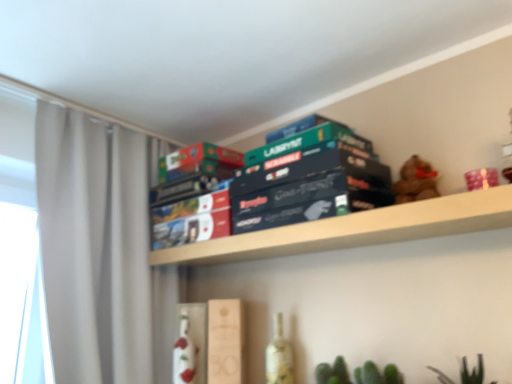
Question: Does dark blue cardboard game box at center have a greater width compared to green matte board game at center, marked as the 3th paperback book in a top-to-bottom arrangement?

Choices:
 (A) yes
 (B) no

Answer: (A)

Question: Does dark blue cardboard game box at center appear on the left side of green matte board game at center, positioned as the 2th paperback book in bottom-to-top order?

Choices:
 (A) no
 (B) yes

Answer: (A)

Question: Is dark blue cardboard game box at center looking in the opposite direction of green matte board game at center, positioned as the 2th paperback book in bottom-to-top order?

Choices:
 (A) yes
 (B) no

Answer: (B)

Question: From the image's perspective, is dark blue cardboard game box at center beneath green matte board game at center, positioned as the 2th paperback book in bottom-to-top order?

Choices:
 (A) no
 (B) yes

Answer: (B)

Question: Is dark blue cardboard game box at center shorter than green matte board game at center, positioned as the 2th paperback book in bottom-to-top order?

Choices:
 (A) yes
 (B) no

Answer: (B)

Question: Considering their positions, is green matte board game at center, positioned as the 2th paperback book in bottom-to-top order, located in front of or behind green matte board game box at center, the 2th paperback book from the top?

Choices:
 (A) front
 (B) behind

Answer: (A)

Question: Which is correct: green matte board game at center, marked as the 3th paperback book in a top-to-bottom arrangement, is inside green matte board game box at center, the 3th paperback book from the bottom, or outside of it?

Choices:
 (A) outside
 (B) inside

Answer: (A)

Question: From the image's perspective, relative to green matte board game box at center, the 2th paperback book from the top, is green matte board game at center, positioned as the 2th paperback book in bottom-to-top order, above or below?

Choices:
 (A) above
 (B) below

Answer: (B)

Question: Considering the positions of point (243, 183) and point (204, 153), is point (243, 183) closer or farther from the camera than point (204, 153)?

Choices:
 (A) farther
 (B) closer

Answer: (B)

Question: Visually, is green matte board game at upper center, the 1th paperback book when ordered from top to bottom, positioned to the left or to the right of wooden box at center, marked as the 4th paperback book in a top-to-bottom arrangement?

Choices:
 (A) left
 (B) right

Answer: (B)

Question: Is green matte board game at upper center, the 1th paperback book when ordered from top to bottom, taller or shorter than wooden box at center, the 1th paperback book when ordered from bottom to top?

Choices:
 (A) tall
 (B) short

Answer: (B)

Question: Does point (326, 129) appear closer or farther from the camera than point (219, 314)?

Choices:
 (A) closer
 (B) farther

Answer: (A)

Question: From the image's perspective, is green matte board game at upper center, which ranks as the 4th paperback book in bottom-to-top order, positioned above or below wooden box at center, the 1th paperback book when ordered from bottom to top?

Choices:
 (A) below
 (B) above

Answer: (B)

Question: Is white glossy bottle at center, which is the second bottle in right-to-left order, wider or thinner than green matte board game box at center, the 2th paperback book from the top?

Choices:
 (A) wide
 (B) thin

Answer: (B)

Question: Considering the positions of point (173, 380) and point (173, 168), is point (173, 380) closer or farther from the camera than point (173, 168)?

Choices:
 (A) closer
 (B) farther

Answer: (A)